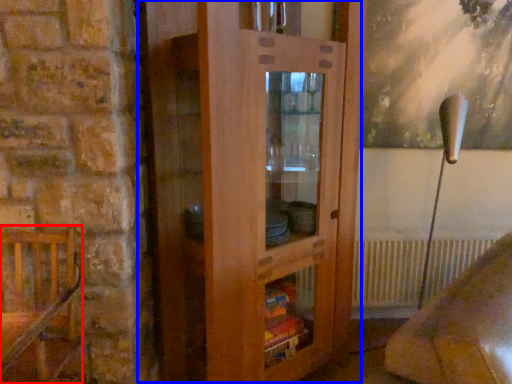
Question: Which point is further to the camera, furniture (highlighted by a red box) or dresser (highlighted by a blue box)?

Choices:
 (A) furniture
 (B) dresser

Answer: (B)